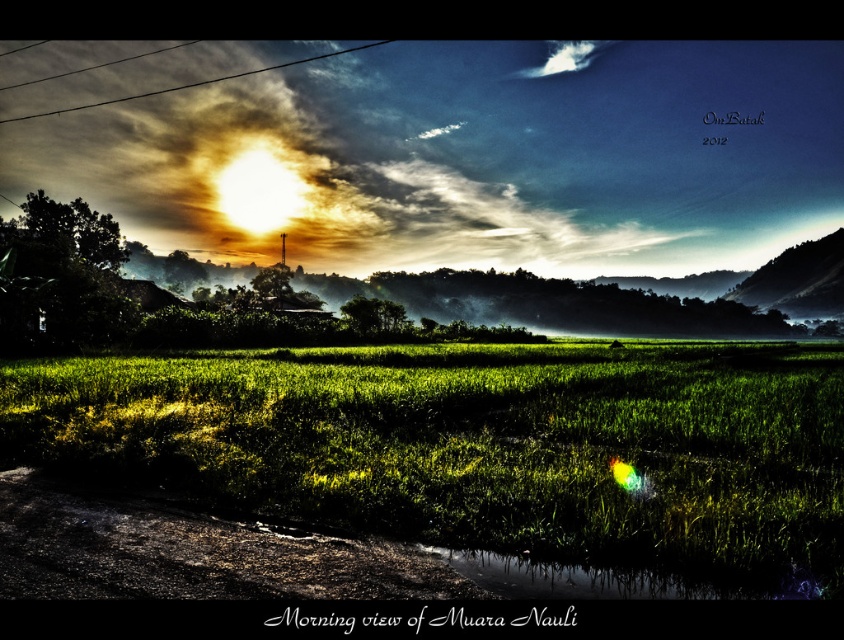
Question: Is green grass at center positioned before metallic wire at upper left?

Choices:
 (A) yes
 (B) no

Answer: (A)

Question: From the image, what is the correct spatial relationship of green grass at center in relation to metallic wire at upper left?

Choices:
 (A) left
 (B) right

Answer: (B)

Question: Which point appears closest to the camera in this image?

Choices:
 (A) (11, 120)
 (B) (318, 500)

Answer: (B)

Question: Is green grass at center smaller than metallic wire at upper left?

Choices:
 (A) no
 (B) yes

Answer: (B)